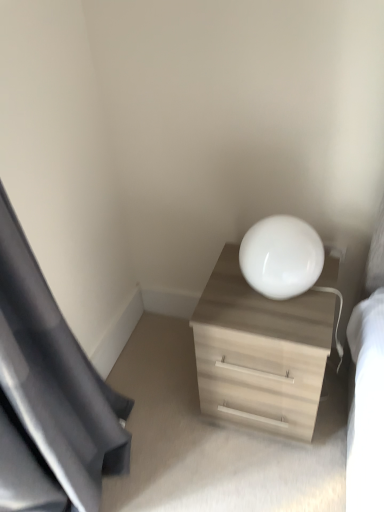
What are the coordinates of `free space to the right of black fabric curtain at left` in the screenshot? It's located at (179, 457).